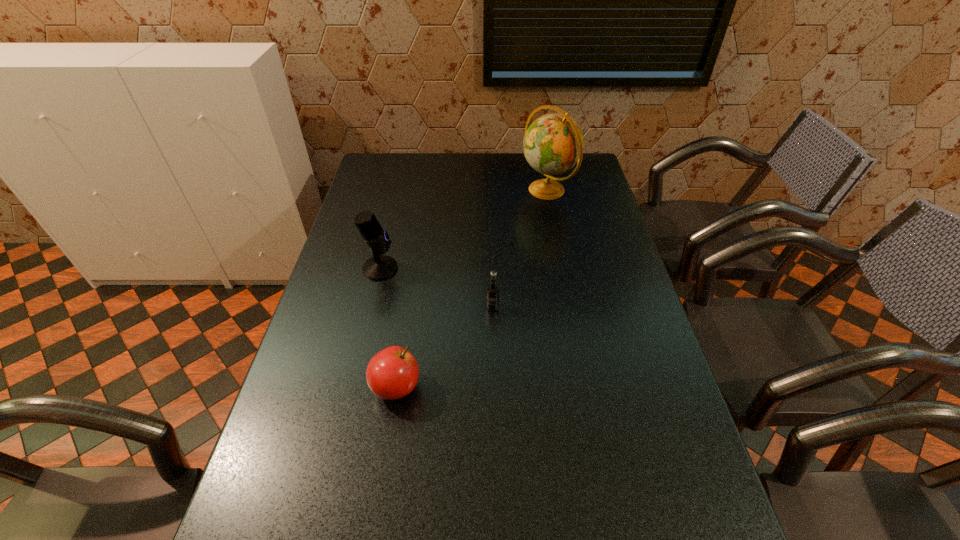
Identify the location of object that is the third closest to the microphone. (553, 144).

Select which object is the closest to the microphone. Please provide its 2D coordinates. Your answer should be formatted as a tuple, i.e. [(x, y)], where the tuple contains the x and y coordinates of a point satisfying the conditions above.

[(492, 305)]

This screenshot has width=960, height=540. Identify the location of free space that satisfies the following two spatial constraints: 1. on the stand of the third nearest object; 2. on the back side of the shortest object. (351, 387).

At what (x,y) coordinates should I click in order to perform the action: click on free location that satisfies the following two spatial constraints: 1. on the stand of the third shortest object; 2. on the right side of the shortest object. Please return your answer as a coordinate pair (x, y). Looking at the image, I should click on tap(351, 387).